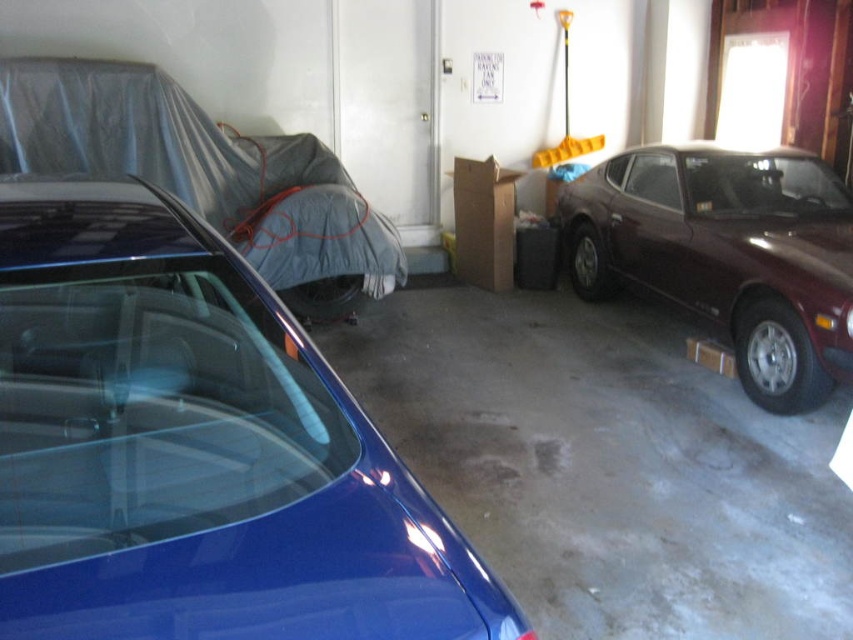
You need to park a new car in the garage. The new car is wider than the glossy blue car at center but narrower than the maroon metallic car at right. Where should you park it so that it doesn t block the entrance?

You should park the new car between the glossy blue car at center and the maroon metallic car at right. Since the glossy blue car at center is narrower than the maroon metallic car at right, there should be enough space between them to accommodate a car wider than the blue one but narrower than the maroon one without blocking the entrance.

You are driving a car that is 2 meters wide and want to park it in the garage. The glossy blue car at center and the maroon metallic car at right are already parked. Based on their positions, can you fit your car between them without moving the existing cars?

The glossy blue car at center is to the left of the maroon metallic car at right, so there is space between them. Since your car is 2 meters wide, you can fit it between the glossy blue car at center and the maroon metallic car at right if the available space is at least 2 meters wide.